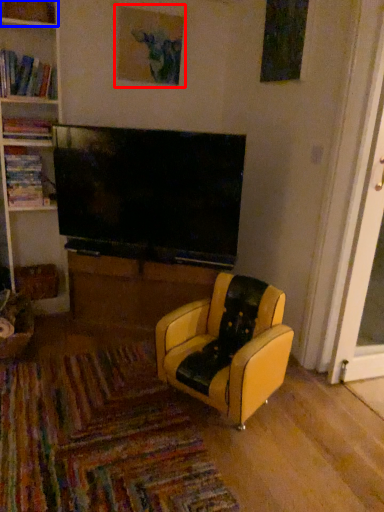
Question: Which of the following is the closest to the observer, picture frame (highlighted by a red box) or shelf (highlighted by a blue box)?

Choices:
 (A) picture frame
 (B) shelf

Answer: (B)